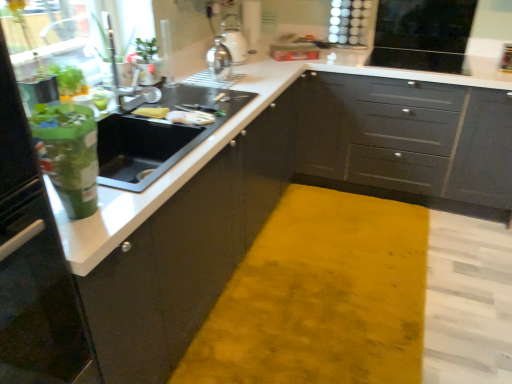
Question: Considering their positions, is black glossy microwave at upper right, which is the 3th appliance from left to right, located in front of or behind matte gray cabinets at center, arranged as the 1th cabinetry when viewed from the back?

Choices:
 (A) front
 (B) behind

Answer: (B)

Question: From their relative heights in the image, would you say black glossy microwave at upper right, which is the first appliance in back-to-front order, is taller or shorter than matte gray cabinets at center, arranged as the 1th cabinetry when viewed from the back?

Choices:
 (A) short
 (B) tall

Answer: (A)

Question: Which object is positioned closest to the matte gray cabinets at center, arranged as the 1th cabinetry when viewed from the back?

Choices:
 (A) matte black cabinets at center, which is the 1th cabinetry from front to back
 (B) yellow sponge at sink, the first food in the left-to-right sequence
 (C) satin silver kettle at upper center, the 2th appliance from the back
 (D) black glossy microwave at upper right, positioned as the first appliance in right-to-left order
 (E) white glossy cutting board at upper center, marked as the 1th food in a right-to-left arrangement

Answer: (A)

Question: Which object is positioned farthest from the white glossy cutting board at upper center, marked as the 1th food in a right-to-left arrangement?

Choices:
 (A) satin silver kettle at upper center, the second appliance viewed from the right
 (B) yellow sponge at sink, the first food in the left-to-right sequence
 (C) matte gray cabinets at center, which appears as the 2th cabinetry when viewed from the front
 (D) transparent glass door at upper left
 (E) matte black cabinets at center, arranged as the 2th cabinetry when viewed from the back

Answer: (C)